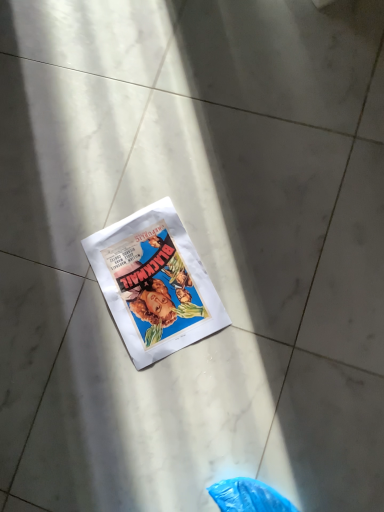
Locate an element on the screen. Image resolution: width=384 pixels, height=512 pixels. printed paper poster at center is located at coordinates (154, 283).

What do you see at coordinates (154, 283) in the screenshot? Image resolution: width=384 pixels, height=512 pixels. I see `printed paper poster at center` at bounding box center [154, 283].

I want to click on printed paper poster at center, so click(154, 283).